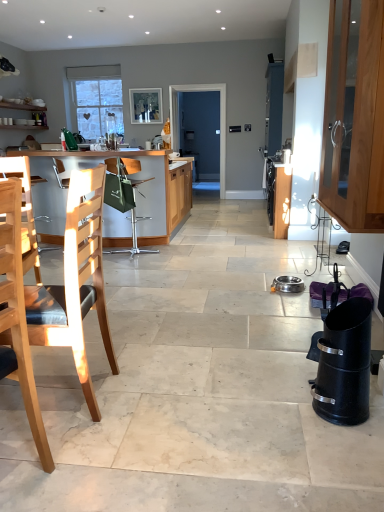
Find the location of `vacant space underneath light wood chair at left, marked as the first chair in a front-to-back arrangement (from a real-world perspective)`. vacant space underneath light wood chair at left, marked as the first chair in a front-to-back arrangement (from a real-world perspective) is located at coordinates (15, 481).